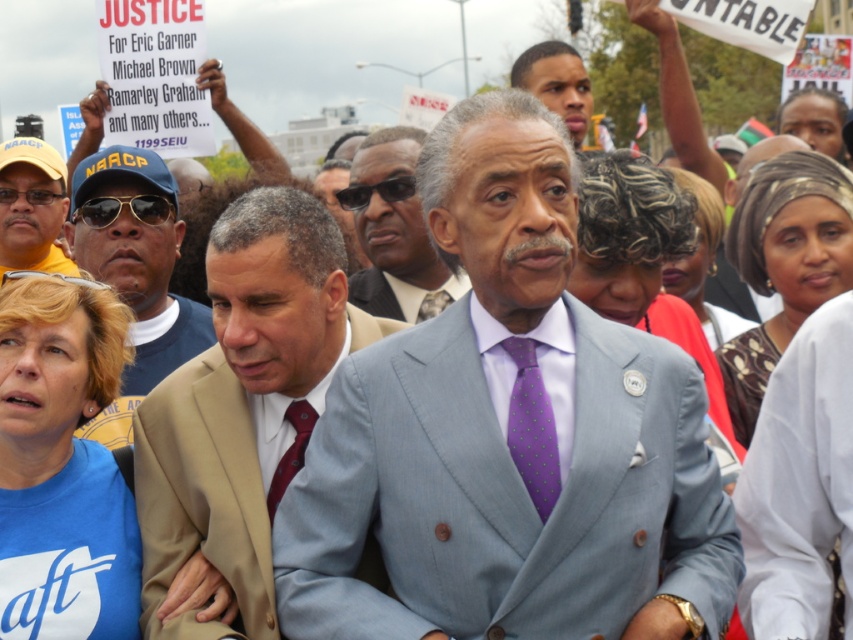
Question: Is matte black face at upper center to the right of maroon silk tie at center from the viewer's perspective?

Choices:
 (A) no
 (B) yes

Answer: (B)

Question: Does light blue suit at center have a greater width compared to tan suit at center?

Choices:
 (A) no
 (B) yes

Answer: (B)

Question: Which object is the farthest from the light blue suit at center?

Choices:
 (A) tan suit at center
 (B) matte black face at upper center

Answer: (B)

Question: Does purple dotted tie at center appear on the left side of matte black face at upper center?

Choices:
 (A) yes
 (B) no

Answer: (A)

Question: Estimate the real-world distances between objects in this image. Which object is farther from the light blue suit at center?

Choices:
 (A) light gray suit at center
 (B) purple dotted tie at center
 (C) maroon silk tie at center
 (D) tan suit at center

Answer: (A)

Question: Considering the real-world distances, which object is farthest from the light gray suit at center?

Choices:
 (A) tan suit at center
 (B) maroon silk tie at center

Answer: (B)